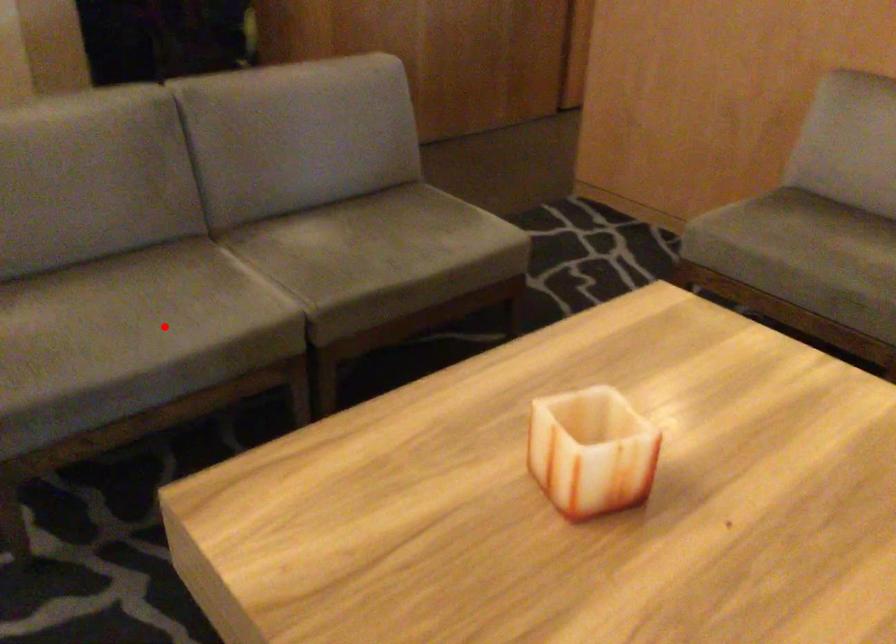
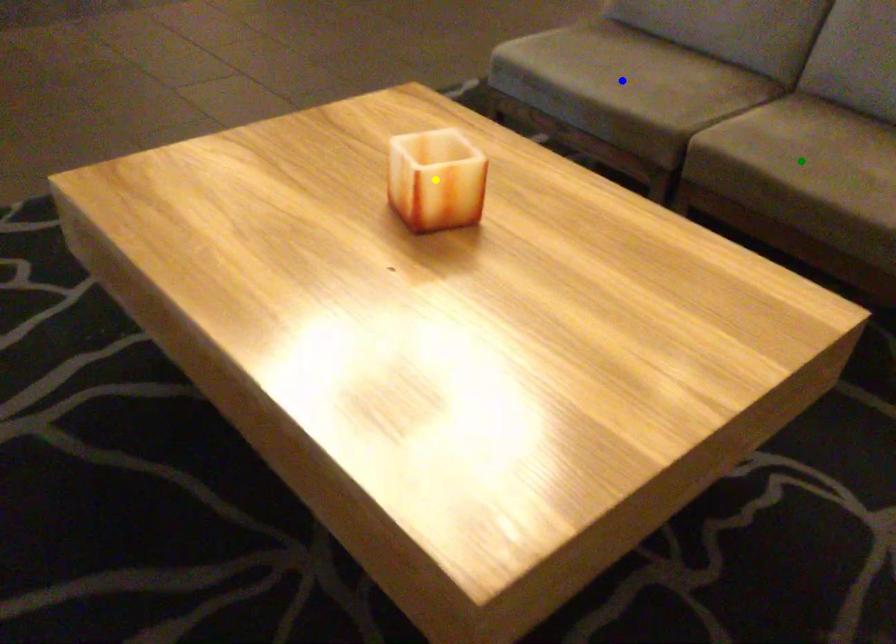
Question: I am providing you with two images of the same scene from different viewpoints. A red point is marked on the first image. You are given multiple points on the second image. Which point in image 2 is actually the same real-world point as the red point in image 1?

Choices:
 (A) green point
 (B) blue point
 (C) yellow point

Answer: (B)